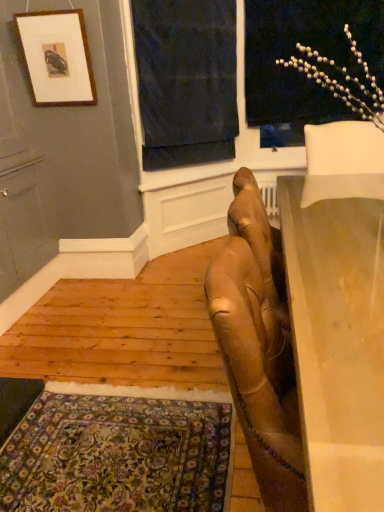
Image resolution: width=384 pixels, height=512 pixels. Describe the element at coordinates (119, 451) in the screenshot. I see `carpeted rug at lower left` at that location.

Describe the element at coordinates (338, 333) in the screenshot. The image size is (384, 512). I see `smooth beige table at right` at that location.

The image size is (384, 512). Identify the location of smooth beige table at right. (338, 333).

The width and height of the screenshot is (384, 512). Find the location of `dark blue fabric at upper center`. dark blue fabric at upper center is located at coordinates (186, 80).

Is white matte floral arrangement at upper right wider than carpeted rug at lower left?

No, white matte floral arrangement at upper right is not wider than carpeted rug at lower left.

Looking at this image, would you say white matte floral arrangement at upper right is outside carpeted rug at lower left?

Yes, white matte floral arrangement at upper right is outside of carpeted rug at lower left.

Where is `flower behind the carpeted rug at lower left`? Image resolution: width=384 pixels, height=512 pixels. flower behind the carpeted rug at lower left is located at coordinates (345, 79).

In the scene shown: From a real-world perspective, which object stands above the other?

white matte floral arrangement at upper right, from a real-world perspective.

Can you confirm if matte wooden picture frame at upper left is taller than carpeted rug at lower left?

Correct, matte wooden picture frame at upper left is much taller as carpeted rug at lower left.

How many degrees apart are the facing directions of matte wooden picture frame at upper left and carpeted rug at lower left?

They differ by 89.5 degrees in their facing directions.

From the image's perspective, which is above, matte wooden picture frame at upper left or carpeted rug at lower left?

matte wooden picture frame at upper left.

Looking at this image, does carpeted rug at lower left have a smaller size compared to dark blue fabric at upper center?

Correct, carpeted rug at lower left occupies less space than dark blue fabric at upper center.

Which object is wider, carpeted rug at lower left or dark blue fabric at upper center?

carpeted rug at lower left.

From the image's perspective, is carpeted rug at lower left located above or below dark blue fabric at upper center?

carpeted rug at lower left is below dark blue fabric at upper center.

Locate an element on the screen. mat lying in front of the dark blue fabric at upper center is located at coordinates (119, 451).

Is smooth beige table at right looking in the opposite direction of dark blue fabric at upper center?

No, dark blue fabric at upper center is not at the back of smooth beige table at right.

From the image's perspective, between smooth beige table at right and dark blue fabric at upper center, who is located below?

From the image's view, smooth beige table at right is below.

Between smooth beige table at right and dark blue fabric at upper center, which one appears on the right side from the viewer's perspective?

smooth beige table at right is more to the right.

Is smooth beige table at right next to dark blue fabric at upper center?

smooth beige table at right is not next to dark blue fabric at upper center, and they're not touching.

Does matte wooden picture frame at upper left have a smaller size compared to dark blue fabric at upper center?

Correct, matte wooden picture frame at upper left occupies less space than dark blue fabric at upper center.

Do you think matte wooden picture frame at upper left is within dark blue fabric at upper center, or outside of it?

matte wooden picture frame at upper left is located beyond the bounds of dark blue fabric at upper center.

Identify the location of curtain lying on the right of matte wooden picture frame at upper left. pos(186,80).

Is matte wooden picture frame at upper left beside dark blue fabric at upper center?

No, matte wooden picture frame at upper left is not next to dark blue fabric at upper center.

Is white matte floral arrangement at upper right looking in the opposite direction of dark blue fabric at upper center?

No, white matte floral arrangement at upper right's orientation is not away from dark blue fabric at upper center.

From a real-world perspective, relative to dark blue fabric at upper center, is white matte floral arrangement at upper right vertically above or below?

Clearly, from a real-world perspective, white matte floral arrangement at upper right is above dark blue fabric at upper center.

Consider the image. Measure the distance between white matte floral arrangement at upper right and dark blue fabric at upper center.

white matte floral arrangement at upper right is 1.10 meters from dark blue fabric at upper center.

Between point (377, 99) and point (200, 158), which one is positioned in front?

Positioned in front is point (377, 99).

This screenshot has height=512, width=384. I want to click on curtain that appears on the right of carpeted rug at lower left, so click(x=186, y=80).

Is dark blue fabric at upper center looking in the opposite direction of carpeted rug at lower left?

That's not correct — dark blue fabric at upper center is not looking away from carpeted rug at lower left.

From a real-world perspective, is dark blue fabric at upper center above or below carpeted rug at lower left?

In terms of real-world spatial position, dark blue fabric at upper center is above carpeted rug at lower left.

You are a GUI agent. You are given a task and a screenshot of the screen. Output one action in this format:
    pyautogui.click(x=<x>, y=<y>)
    Task: Click on the flower that appears on the right of carpeted rug at lower left
    Image resolution: width=384 pixels, height=512 pixels.
    Given the screenshot: What is the action you would take?
    pyautogui.click(x=345, y=79)

Locate an element on the screen. The width and height of the screenshot is (384, 512). picture frame located above the carpeted rug at lower left (from a real-world perspective) is located at coordinates (57, 57).

Looking at the image, which one is located further to dark blue fabric at upper center, matte wooden picture frame at upper left or white matte floral arrangement at upper right?

Among the two, white matte floral arrangement at upper right is located further to dark blue fabric at upper center.

Based on their spatial positions, is white matte floral arrangement at upper right or smooth beige table at right closer to carpeted rug at lower left?

Based on the image, smooth beige table at right appears to be nearer to carpeted rug at lower left.

Considering their positions, is smooth beige table at right positioned further to matte wooden picture frame at upper left than carpeted rug at lower left?

carpeted rug at lower left.

Looking at the image, which one is located closer to smooth beige table at right, white matte floral arrangement at upper right or dark blue fabric at upper center?

white matte floral arrangement at upper right is closer to smooth beige table at right.

From the image, which object appears to be nearer to dark blue fabric at upper center, white matte floral arrangement at upper right or carpeted rug at lower left?

Based on the image, white matte floral arrangement at upper right appears to be nearer to dark blue fabric at upper center.

Based on their spatial positions, is smooth beige table at right or white matte floral arrangement at upper right further from carpeted rug at lower left?

Based on the image, white matte floral arrangement at upper right appears to be further to carpeted rug at lower left.

Which object lies further to the anchor point dark blue fabric at upper center, smooth beige table at right or carpeted rug at lower left?

carpeted rug at lower left is further to dark blue fabric at upper center.

From the picture: When comparing their distances from carpeted rug at lower left, does dark blue fabric at upper center or smooth beige table at right seem closer?

smooth beige table at right.

The image size is (384, 512). In order to click on curtain between smooth beige table at right and white matte floral arrangement at upper right from front to back in this screenshot , I will do `click(186, 80)`.

The image size is (384, 512). Find the location of `curtain between white matte floral arrangement at upper right and carpeted rug at lower left from top to bottom`. curtain between white matte floral arrangement at upper right and carpeted rug at lower left from top to bottom is located at coordinates (186, 80).

Locate an element on the screen. curtain located between matte wooden picture frame at upper left and white matte floral arrangement at upper right in the left-right direction is located at coordinates (186, 80).

Locate an element on the screen. This screenshot has height=512, width=384. mat between smooth beige table at right and white matte floral arrangement at upper right from front to back is located at coordinates (119, 451).